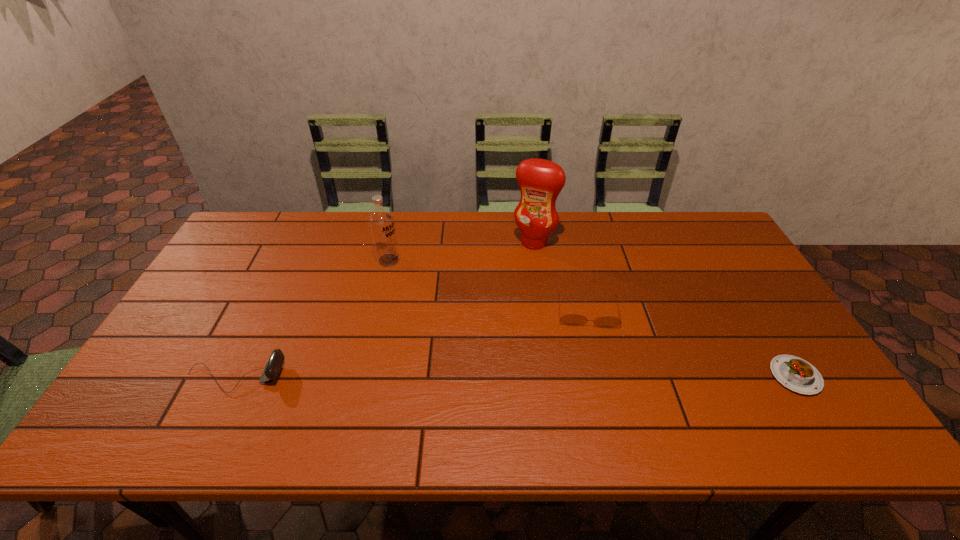
Image resolution: width=960 pixels, height=540 pixels. I want to click on webcam positioned at the near edge, so click(x=274, y=364).

This screenshot has height=540, width=960. Identify the location of pudding that is at the near edge. tap(798, 375).

Identify the location of object at the left edge. (274, 364).

Identify the location of object located at the right edge. (798, 375).

Find the location of a particular element. The image size is (960, 540). object present at the near left corner is located at coordinates (274, 364).

This screenshot has height=540, width=960. I want to click on object located in the near right corner section of the desktop, so [x=798, y=375].

Image resolution: width=960 pixels, height=540 pixels. Identify the location of vacant space at the far edge of the desktop. (329, 212).

I want to click on vacant space at the near edge, so click(753, 397).

This screenshot has height=540, width=960. Identify the location of vacant space at the left edge of the desktop. (199, 352).

This screenshot has width=960, height=540. In the image, there is a desktop. What are the coordinates of `vacant space at the right edge` in the screenshot? It's located at (734, 294).